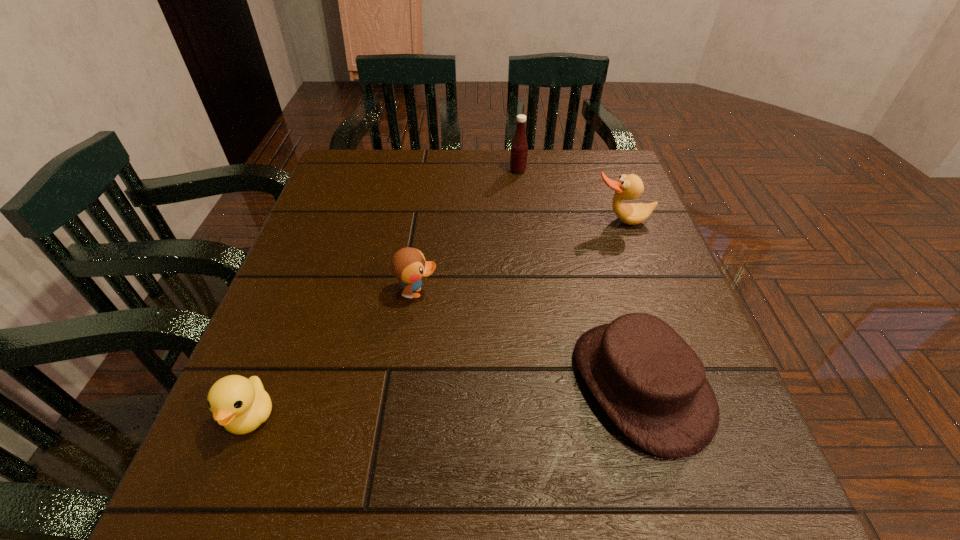
The height and width of the screenshot is (540, 960). I want to click on free point between the hat and the farthest duck, so click(631, 302).

Locate an element on the screen. free space between the third nearest object and the leftmost object is located at coordinates (334, 354).

Where is `vacant space that's between the hat and the rightmost duck`? vacant space that's between the hat and the rightmost duck is located at coordinates (631, 302).

Where is `vacant space in between the hat and the farthest object`? vacant space in between the hat and the farthest object is located at coordinates (579, 277).

You are a GUI agent. You are given a task and a screenshot of the screen. Output one action in this format:
    pyautogui.click(x=<x>, y=<y>)
    Task: Click on the vacant area that lies between the third object from left to right and the fourth nearest object
    This screenshot has height=540, width=960.
    Given the screenshot: What is the action you would take?
    pyautogui.click(x=569, y=196)

Locate which object is the closest to the farthest duck. Please provide its 2D coordinates. Your answer should be formatted as a tuple, i.e. [(x, y)], where the tuple contains the x and y coordinates of a point satisfying the conditions above.

[(519, 148)]

Where is `object that stands as the third closest to the farthest object`? object that stands as the third closest to the farthest object is located at coordinates (652, 385).

In order to click on duck that is the closest one to the hat in this screenshot , I will do `click(408, 265)`.

Where is `duck that is the third closest to the hat`? The height and width of the screenshot is (540, 960). duck that is the third closest to the hat is located at coordinates (241, 405).

Identify the location of blank area in the image that satisfies the following two spatial constraints: 1. on the beak of the second farthest object; 2. on the front-facing side of the second object from left to right. (648, 293).